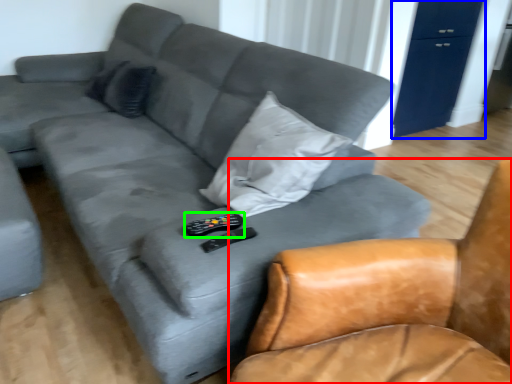
Question: Which object is the farthest from chair (highlighted by a red box)? Choose among these: dresser (highlighted by a blue box) or remote (highlighted by a green box).

Choices:
 (A) dresser
 (B) remote

Answer: (A)